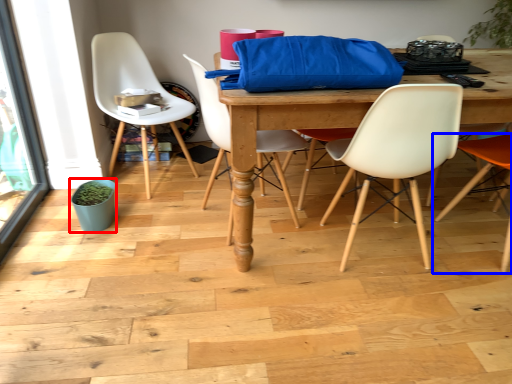
Question: Which object appears closest to the camera in this image, flowerpot (highlighted by a red box) or chair (highlighted by a blue box)?

Choices:
 (A) flowerpot
 (B) chair

Answer: (B)